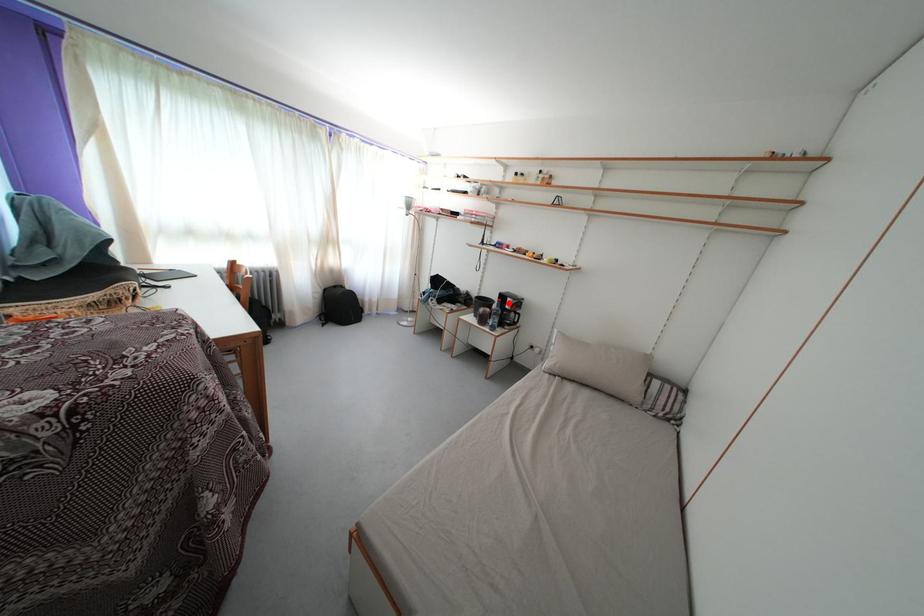
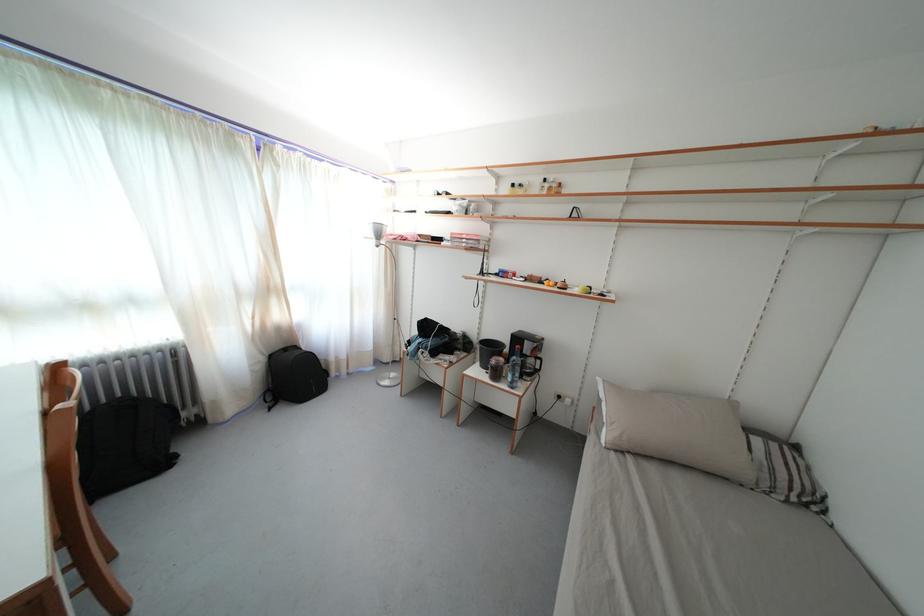
The point at the highlighted location is marked in the first image. Where is the corresponding point in the second image?

(524, 345)